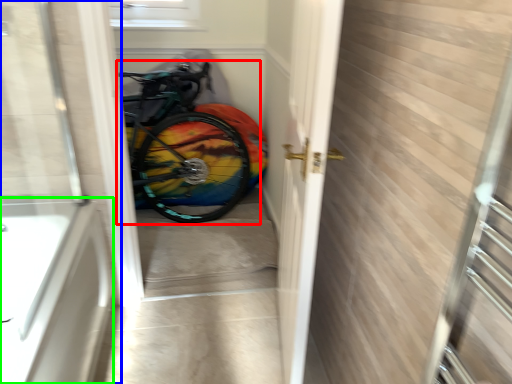
Question: Which is nearer to the bicycle (highlighted by a red box)? door (highlighted by a blue box) or bath (highlighted by a green box).

Choices:
 (A) door
 (B) bath

Answer: (A)